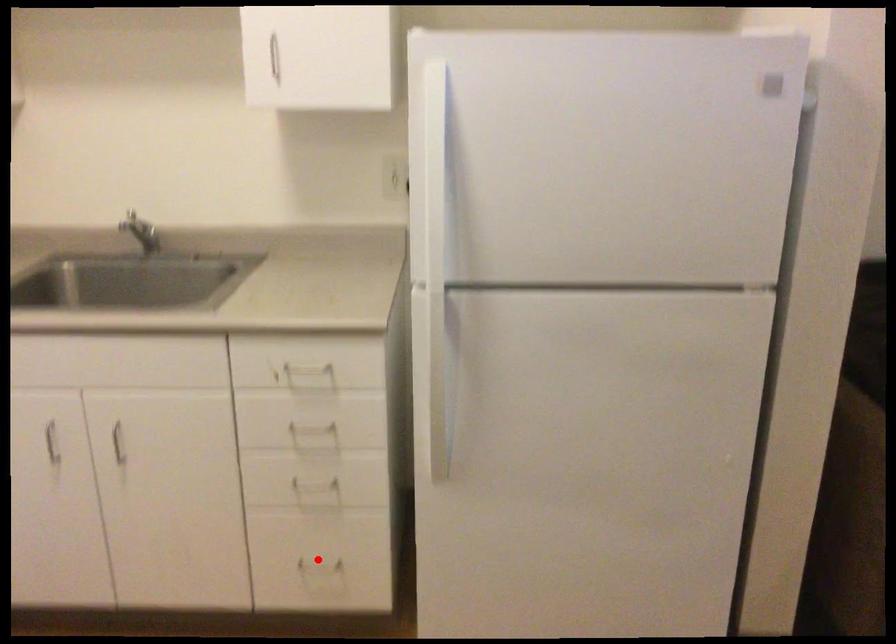
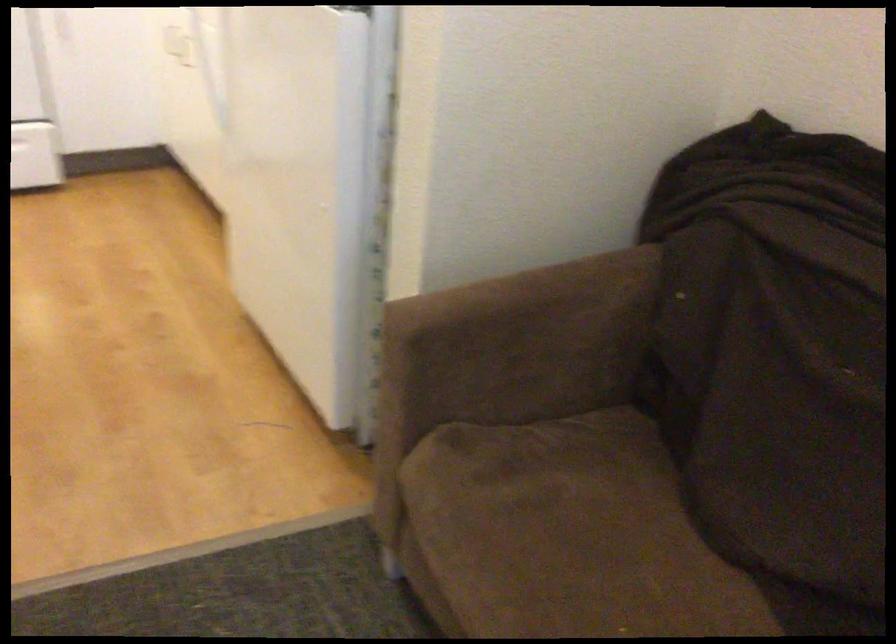
Question: I am providing you with two images of the same scene from different viewpoints. A red point is marked on the first image. Is the red point's position out of view in image 2?

Choices:
 (A) Yes
 (B) No

Answer: (A)